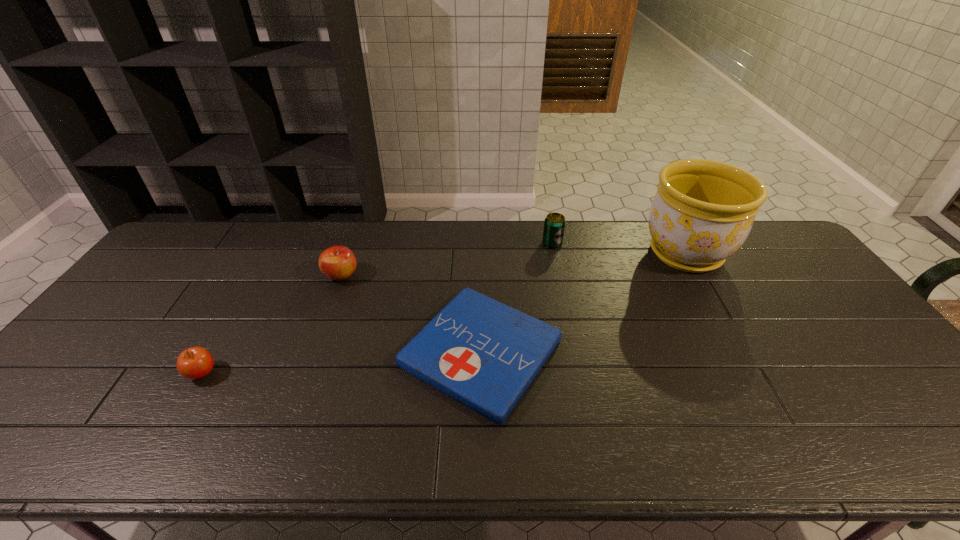
Locate an element on the screen. The height and width of the screenshot is (540, 960). free space at the far right corner is located at coordinates (751, 255).

The width and height of the screenshot is (960, 540). I want to click on unoccupied position between the left apple and the beer can, so click(377, 308).

Where is `free spot between the nearer apple and the first-aid kit`? This screenshot has height=540, width=960. free spot between the nearer apple and the first-aid kit is located at coordinates (342, 362).

The width and height of the screenshot is (960, 540). Identify the location of free spot between the beer can and the right apple. (446, 259).

The image size is (960, 540). Find the location of `vacant space that is in between the beer can and the rightmost object`. vacant space that is in between the beer can and the rightmost object is located at coordinates (619, 248).

The image size is (960, 540). I want to click on empty space between the shortest object and the left apple, so click(342, 362).

The width and height of the screenshot is (960, 540). Find the location of `vacant area between the left apple and the fourth object from right to left`. vacant area between the left apple and the fourth object from right to left is located at coordinates (272, 325).

Image resolution: width=960 pixels, height=540 pixels. I want to click on vacant point located between the second object from left to right and the rightmost object, so click(514, 265).

Locate an element on the screen. free space between the shortest object and the second object from left to right is located at coordinates (411, 314).

This screenshot has height=540, width=960. Find the location of `object that is the second closest to the first-aid kit`. object that is the second closest to the first-aid kit is located at coordinates (554, 225).